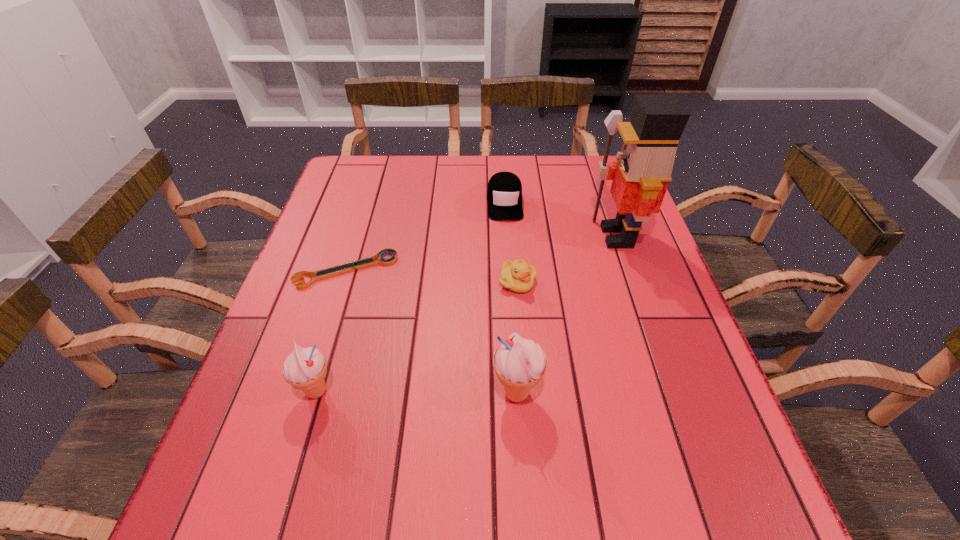
Considering the uniform spacing of icecreams, where should an additional icecream be positioned on the right? Please locate a free spot. Please provide its 2D coordinates. Your answer should be formatted as a tuple, i.e. [(x, y)], where the tuple contains the x and y coordinates of a point satisfying the conditions above.

[(718, 395)]